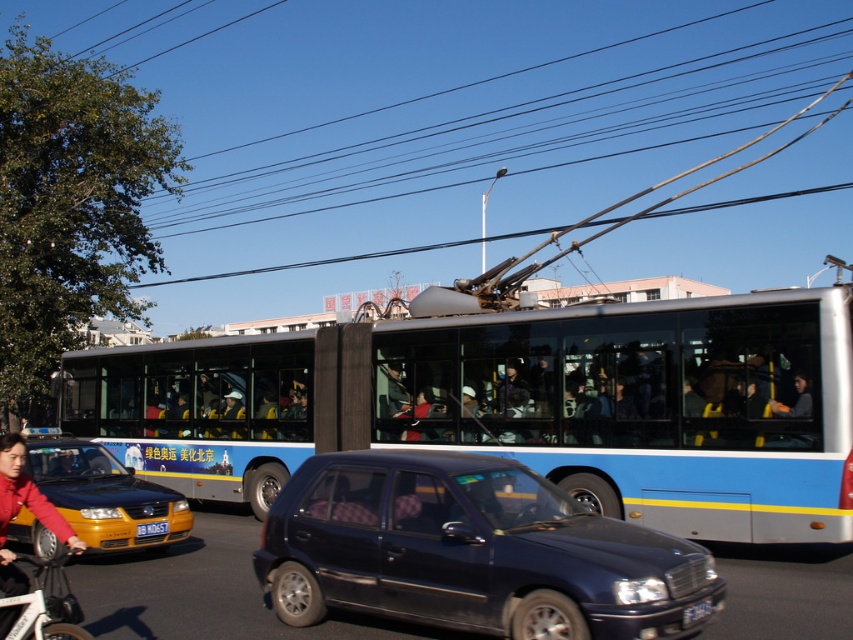
Question: Is the position of blue metallic bus at center less distant than that of yellow matte taxi at lower left?

Choices:
 (A) yes
 (B) no

Answer: (A)

Question: Which object is closer to the camera taking this photo?

Choices:
 (A) yellow matte taxi at lower left
 (B) blue metallic license plate at center
 (C) blue metallic bus at center

Answer: (C)

Question: Does blue metallic bus at center have a lesser width compared to blue metallic license plate at center?

Choices:
 (A) no
 (B) yes

Answer: (A)

Question: Which point is farther to the camera?

Choices:
 (A) (303, 529)
 (B) (44, 449)
 (C) (119, 388)
 (D) (161, 525)

Answer: (C)

Question: Among these objects, which one is farthest from the camera?

Choices:
 (A) red fabric jacket at lower left
 (B) white matte bicycle at lower left

Answer: (A)

Question: Is dark blue matte car at center closer to the viewer compared to red fabric jacket at lower left?

Choices:
 (A) no
 (B) yes

Answer: (A)